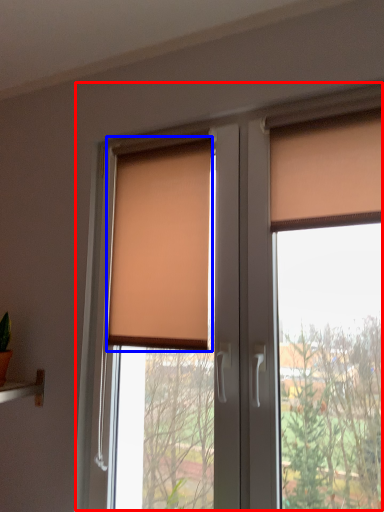
Question: Which object appears closest to the camera in this image, window (highlighted by a red box) or window blind (highlighted by a blue box)?

Choices:
 (A) window
 (B) window blind

Answer: (A)